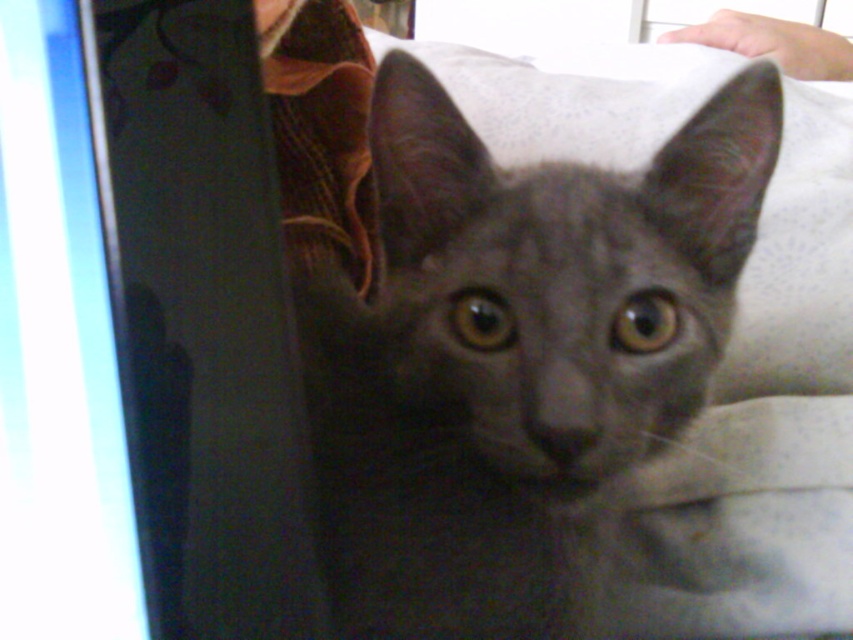
Which of these two, gray matte fur cat at center or matte plastic computer screen at left, stands shorter?

With less height is matte plastic computer screen at left.

Is gray matte fur cat at center bigger than matte plastic computer screen at left?

Indeed, gray matte fur cat at center has a larger size compared to matte plastic computer screen at left.

Between point (692, 134) and point (44, 308), which one is positioned in front?

Point (44, 308) is more forward.

Where is `gray matte fur cat at center`? The width and height of the screenshot is (853, 640). gray matte fur cat at center is located at coordinates (514, 353).